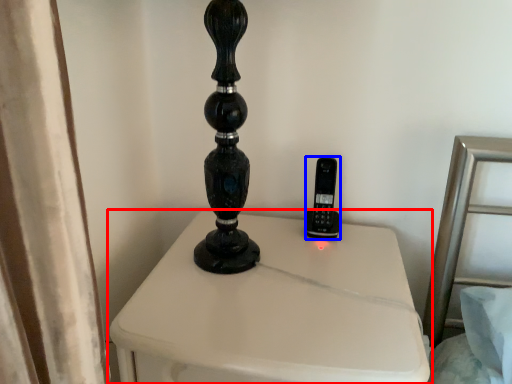
Question: Which object appears farthest to the camera in this image, furniture (highlighted by a red box) or control (highlighted by a blue box)?

Choices:
 (A) furniture
 (B) control

Answer: (B)